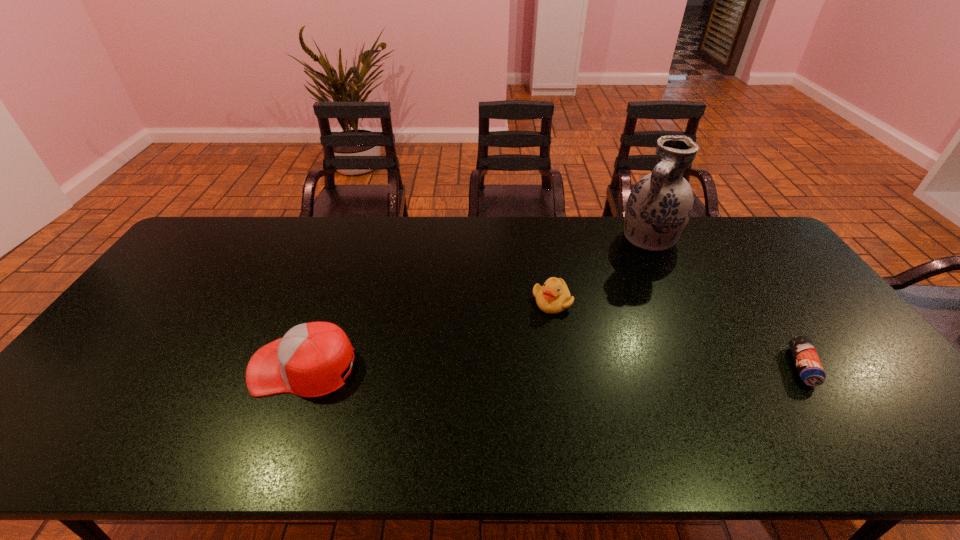
You are a GUI agent. You are given a task and a screenshot of the screen. Output one action in this format:
    pyautogui.click(x=<x>, y=<y>)
    Task: Click on the baseball cap
    
    Given the screenshot: What is the action you would take?
    pos(308,361)

At what (x,y) coordinates should I click in order to perform the action: click on the third shortest object. Please return your answer as a coordinate pair (x, y). Looking at the image, I should click on (308, 361).

The image size is (960, 540). I want to click on the shortest object, so click(810, 369).

Locate an element on the screen. This screenshot has width=960, height=540. the rightmost object is located at coordinates (810, 369).

Identify the location of the second object from left to right. This screenshot has width=960, height=540. (553, 297).

Find the location of `the second farthest object`. the second farthest object is located at coordinates (553, 297).

Find the location of a particular element. the second object from right to left is located at coordinates (659, 206).

This screenshot has height=540, width=960. I want to click on the farthest object, so click(x=659, y=206).

The height and width of the screenshot is (540, 960). What are the coordinates of `vacant area situated 0.170m on the front-facing side of the baseball cap` in the screenshot? It's located at [185, 367].

Image resolution: width=960 pixels, height=540 pixels. I want to click on free space located on the front-facing side of the baseball cap, so click(x=225, y=367).